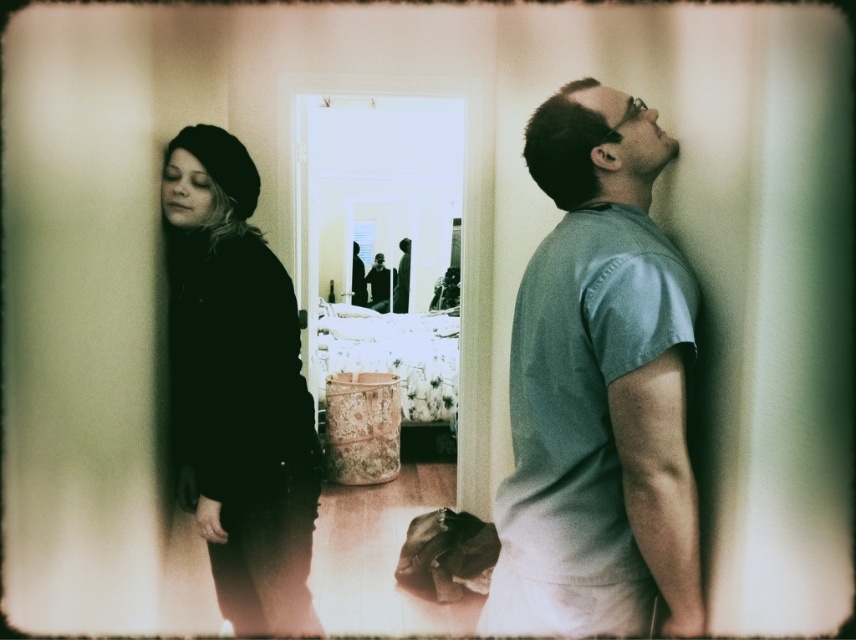
You are an interior designer assessing the spatial arrangement of the room. You notice the dark matte jacket at left and the black matte beret at left. Which object takes up more horizontal space in the scene?

The black matte beret at left takes up more horizontal space than the dark matte jacket at left because the dark matte jacket at left has a lesser width compared to the black matte beret at left.